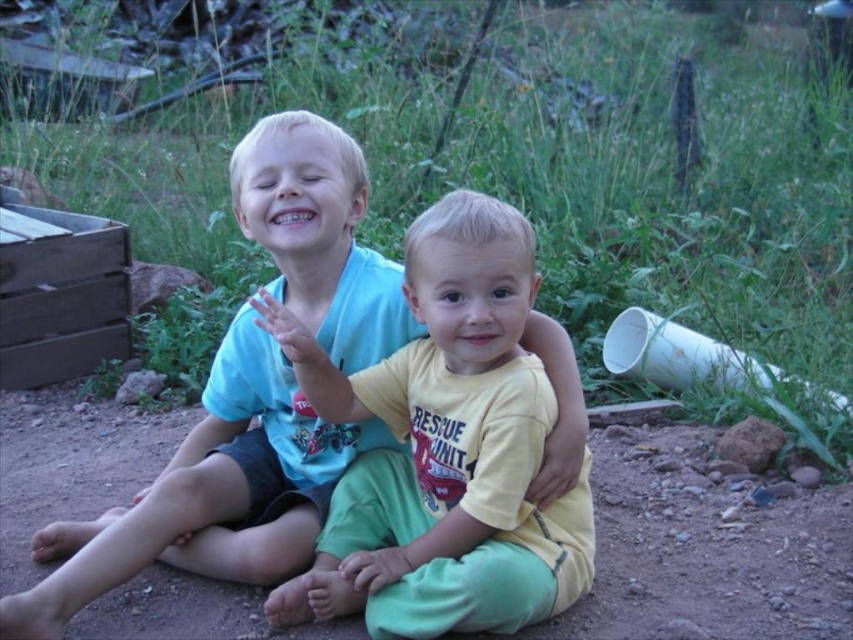
Question: Estimate the real-world distances between objects in this image. Which object is closer to the matte blue shirt at center?

Choices:
 (A) yellow cotton shirt at center
 (B) brown dirt at center

Answer: (A)

Question: Among these points, which one is nearest to the camera?

Choices:
 (A) (292, 198)
 (B) (422, 442)

Answer: (A)

Question: Does matte blue shirt at center lie in front of brown dirt at center?

Choices:
 (A) no
 (B) yes

Answer: (B)

Question: Is matte blue shirt at center above brown dirt at center?

Choices:
 (A) no
 (B) yes

Answer: (B)

Question: Does matte blue shirt at center appear on the left side of brown dirt at center?

Choices:
 (A) no
 (B) yes

Answer: (B)

Question: Which of the following is the closest to the observer?

Choices:
 (A) brown dirt at center
 (B) yellow cotton shirt at center
 (C) matte blue shirt at center

Answer: (B)